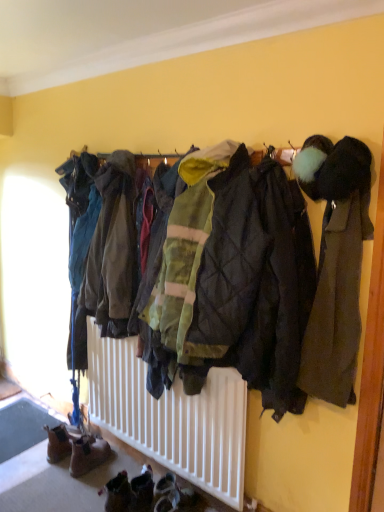
Question: Considering the positions of brown suede boots at lower left and dark gray wool coat at right, which is the 2th jacket from back to front, in the image, is brown suede boots at lower left bigger or smaller than dark gray wool coat at right, which is the 2th jacket from back to front,?

Choices:
 (A) big
 (B) small

Answer: (B)

Question: From a real-world perspective, relative to dark gray wool coat at right, which is the 2th jacket from back to front, is brown suede boots at lower left vertically above or below?

Choices:
 (A) below
 (B) above

Answer: (A)

Question: Which of these objects is positioned farthest from the brown suede boots at lower left?

Choices:
 (A) green quilted jacket at center, which ranks as the second jacket in front-to-back order
 (B) dark gray wool coat at right, which is the 2th jacket from left to right

Answer: (B)

Question: Which object is positioned closest to the dark gray wool coat at right, which is the 2th jacket from back to front?

Choices:
 (A) brown suede boots at lower left
 (B) green quilted jacket at center, which ranks as the 1th jacket in left-to-right order

Answer: (B)